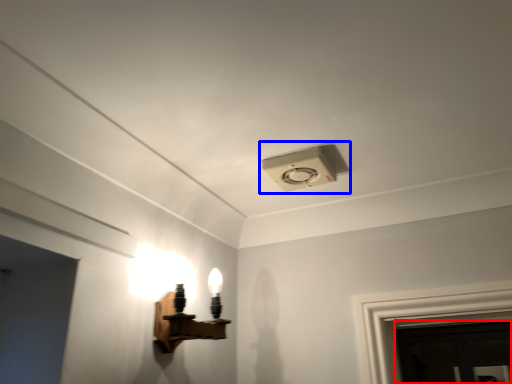
Question: Which object appears farthest to the camera in this image, door (highlighted by a red box) or lamp (highlighted by a blue box)?

Choices:
 (A) door
 (B) lamp

Answer: (A)